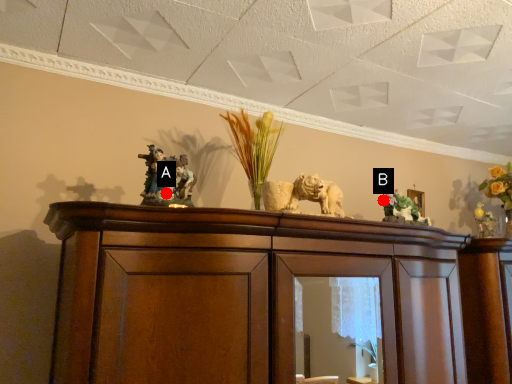
Question: Two points are circled on the image, labeled by A and B beside each circle. Which point appears closest to the camera in this image?

Choices:
 (A) A is closer
 (B) B is closer

Answer: (A)